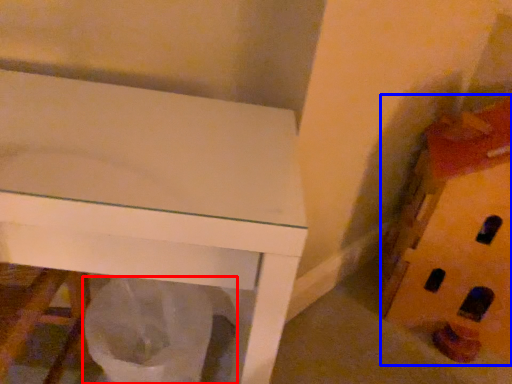
Question: Which of the following is the closest to the observer, garbage (highlighted by a red box) or toy (highlighted by a blue box)?

Choices:
 (A) garbage
 (B) toy

Answer: (A)